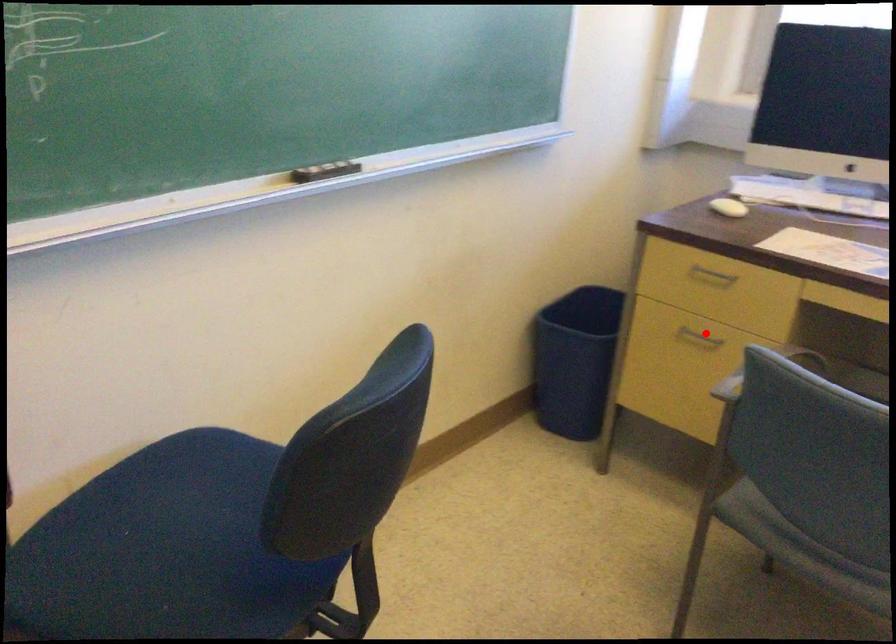
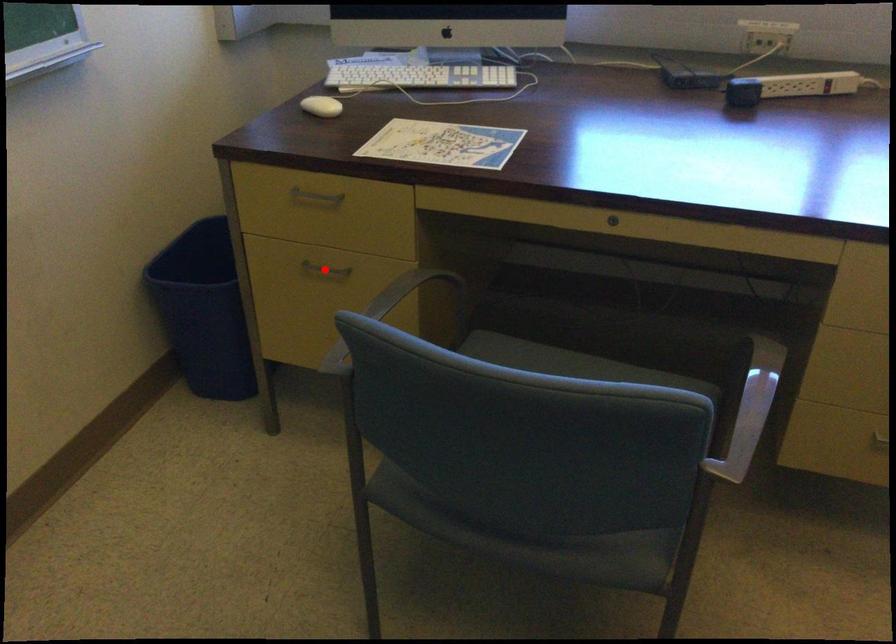
I am providing you with two images of the same scene from different viewpoints. A red point is marked on the first image and another point is marked on the second image. Is the red point in image1 aligned with the point shown in image2?

Yes